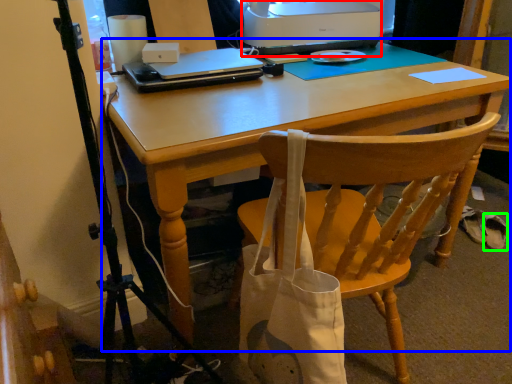
Question: Based on their relative distances, which object is nearer to printer (highlighted by a red box)? Choose from computer desk (highlighted by a blue box) and walking shoe (highlighted by a green box).

Choices:
 (A) computer desk
 (B) walking shoe

Answer: (A)